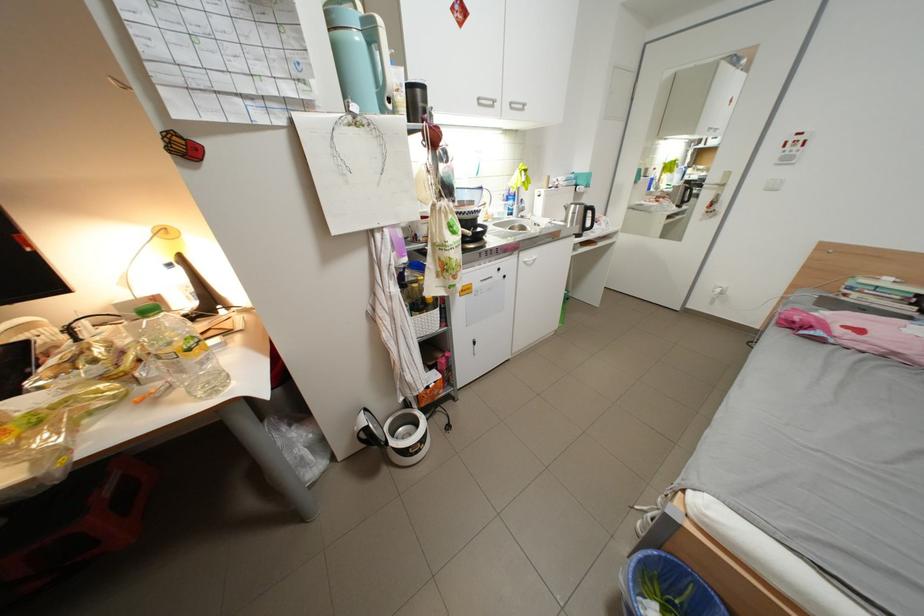
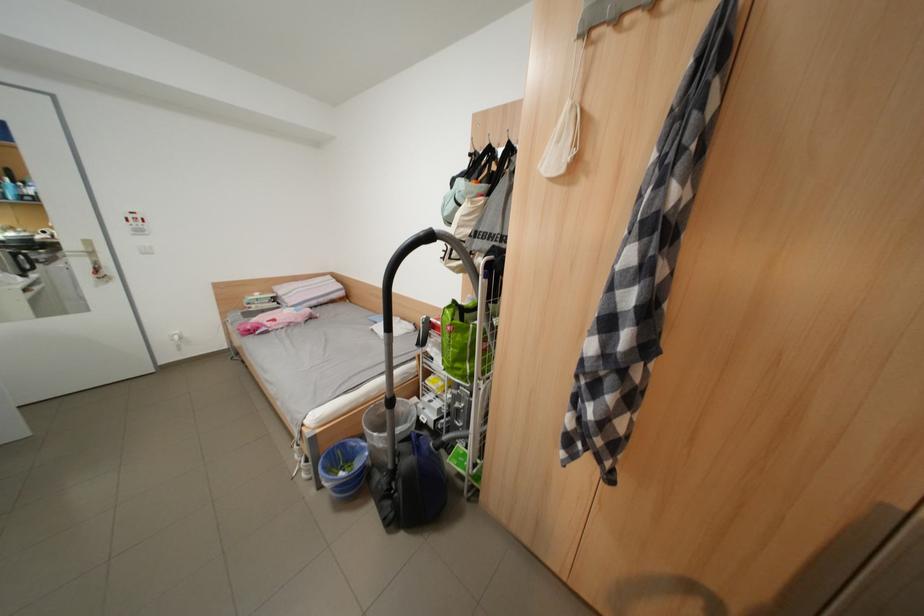
Find the pixel in the second image that matches (728,281) in the first image.

(178, 331)